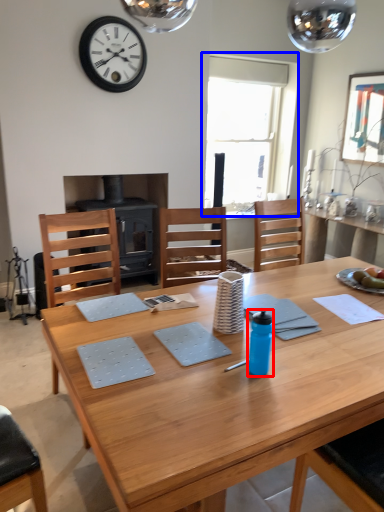
Question: Among these objects, which one is farthest to the camera, bottle (highlighted by a red box) or window (highlighted by a blue box)?

Choices:
 (A) bottle
 (B) window

Answer: (B)